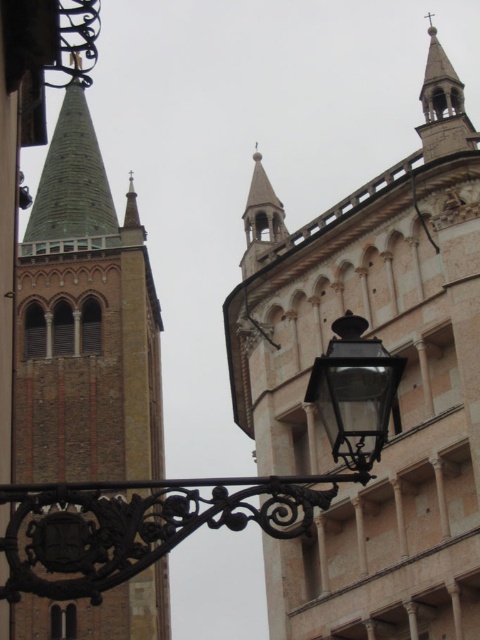
You are a drone operator tasked with flying a drone between the smooth beige tower at center and the green stone tower at left. The drone has a maximum flight distance of 15 meters. Can the drone safely complete the flight between these two towers without exceeding its range?

The distance between the smooth beige tower at center and the green stone tower at left is 16.87 meters, which exceeds the drone operator stated maximum flight distance of 15 meters. Therefore, the drone cannot safely complete the flight between these two towers without exceeding its range.

You are standing in front of the historic building and notice two points marked on the structure. Which point, point (91, 275) or point (226, 509), is closer to you?

Point (91, 275) is closer to you because it is further to the viewer than point (226, 509).

You are an architect analyzing the structural integrity of the green stone tower at left and the smooth stone spire at upper right. Which structure requires more material due to its size?

The green stone tower at left requires more material because it has a larger size compared to the smooth stone spire at upper right.